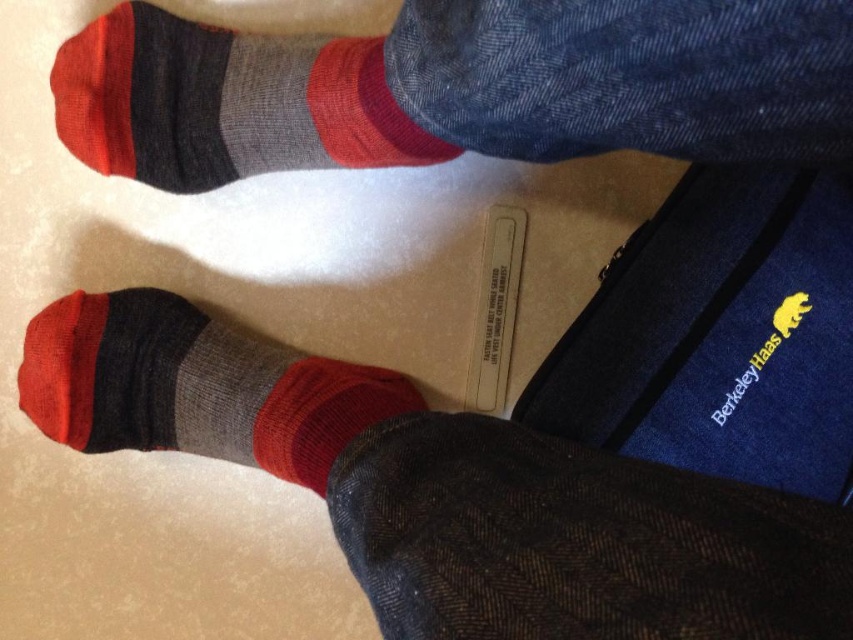
Based on the photo, who is shorter, knit wool socks at center or knit wool socks at upper left?

knit wool socks at upper left is shorter.

The height and width of the screenshot is (640, 853). What do you see at coordinates (444, 486) in the screenshot?
I see `knit wool socks at center` at bounding box center [444, 486].

Where is `knit wool socks at center`? knit wool socks at center is located at coordinates (444, 486).

This screenshot has height=640, width=853. I want to click on knit wool socks at upper left, so click(225, 102).

Measure the distance from knit wool socks at upper left to knit wool sock at lower left.

They are 7.93 inches apart.

Is point (202, 118) positioned before point (91, 314)?

Yes, point (202, 118) is in front of point (91, 314).

Identify the location of knit wool socks at upper left. (225, 102).

Between knit wool socks at center and knit wool sock at lower left, which one is positioned higher?

knit wool sock at lower left is higher up.

Looking at this image, is knit wool socks at center further to the viewer compared to knit wool sock at lower left?

No, it is not.

Describe the element at coordinates (444, 486) in the screenshot. The width and height of the screenshot is (853, 640). I see `knit wool socks at center` at that location.

This screenshot has height=640, width=853. Find the location of `knit wool socks at center`. knit wool socks at center is located at coordinates (444, 486).